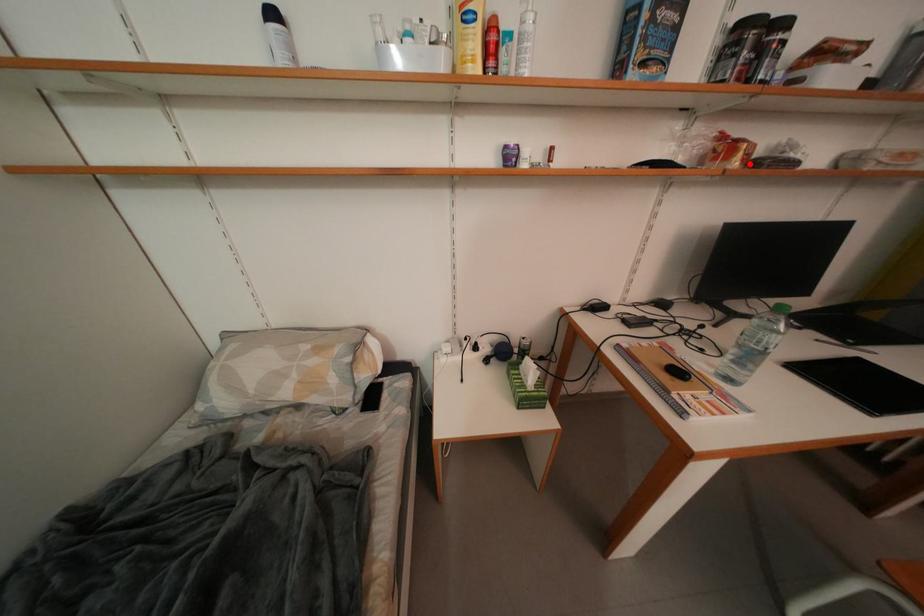
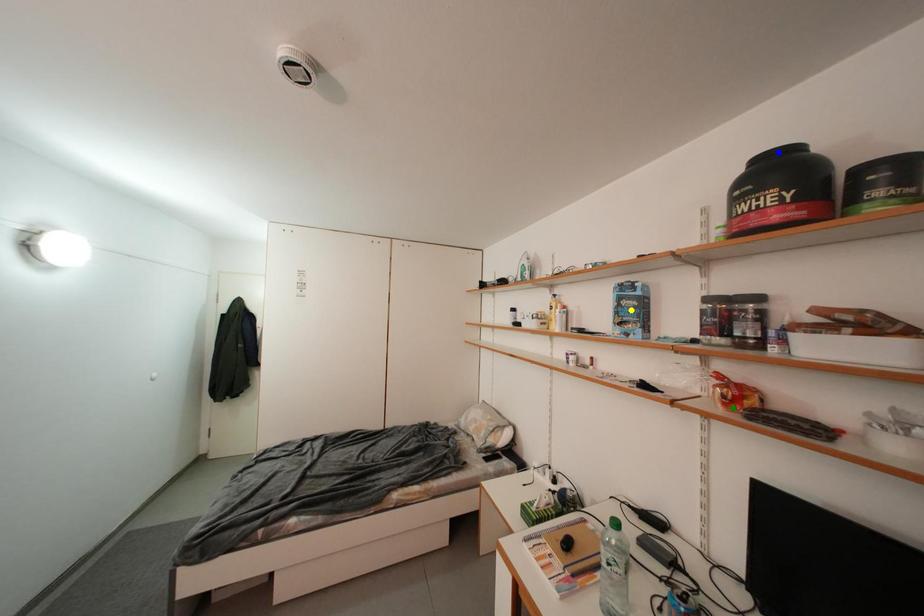
Question: I am providing you with two images of the same scene from different viewpoints. A red point is marked on the first image. You are given multiple points on the second image. Which point in image 2 represents the same 3d spot as the red point in image 1?

Choices:
 (A) blue point
 (B) yellow point
 (C) green point

Answer: (C)